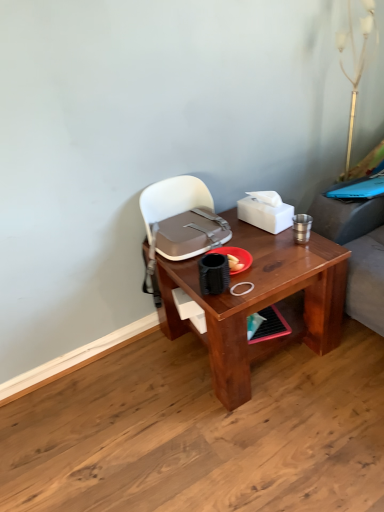
Locate an element on the screen. free region on the left part of brown wooden desk at center is located at coordinates (130, 389).